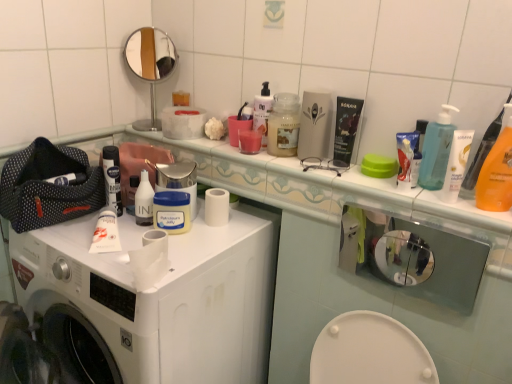
At what (x,y) coordinates should I click in order to perform the action: click on vacant region in front of white glossy bottle at center, which appears as the 4th mouthwash when viewed from the right. Please return your answer as a coordinate pair (x, y). Looking at the image, I should click on (123, 250).